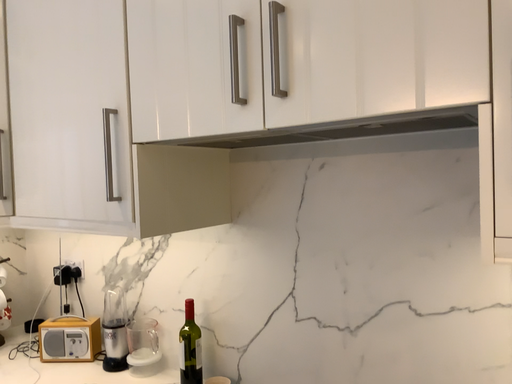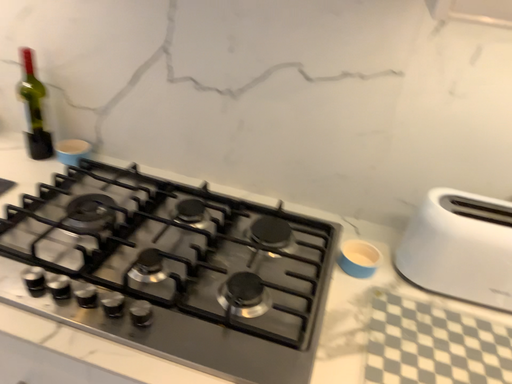
Question: How did the camera likely rotate when shooting the video?

Choices:
 (A) rotated upward
 (B) rotated downward

Answer: (B)